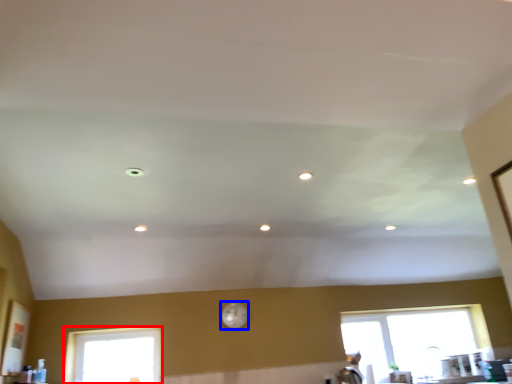
Question: Which of the following is the closest to the observer, window (highlighted by a red box) or clock (highlighted by a blue box)?

Choices:
 (A) window
 (B) clock

Answer: (A)